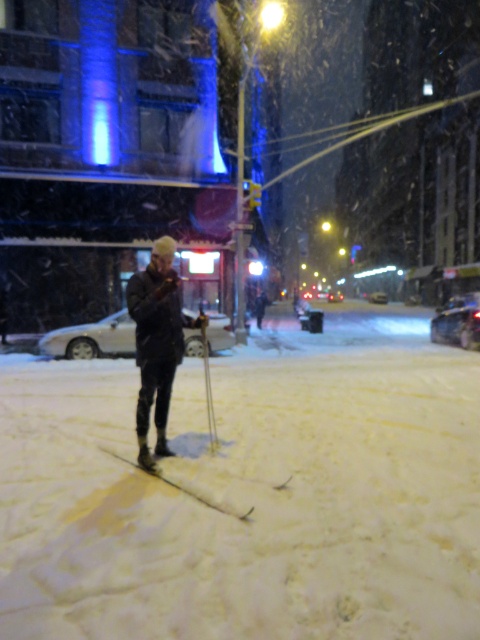
Question: Which of the following is the closest to the observer?

Choices:
 (A) (105, 449)
 (B) (162, 432)
 (C) (27, 364)
 (D) (211, 394)

Answer: (B)

Question: Observing the image, what is the correct spatial positioning of white matte ski at center in reference to metallic silver ski pole at center?

Choices:
 (A) above
 (B) below

Answer: (B)

Question: Does white matte ski at center appear on the right side of metallic silver ski pole at center?

Choices:
 (A) no
 (B) yes

Answer: (B)

Question: Considering the relative positions of dark gray fabric jacket at center and white matte ski at center in the image provided, where is dark gray fabric jacket at center located with respect to white matte ski at center?

Choices:
 (A) left
 (B) right

Answer: (A)

Question: Which object is positioned closest to the dark gray fabric jacket at center?

Choices:
 (A) metallic silver ski pole at center
 (B) white fluffy snow at center
 (C) white matte ski at center

Answer: (C)

Question: Which point is farther to the camera?

Choices:
 (A) (44, 371)
 (B) (158, 292)

Answer: (A)